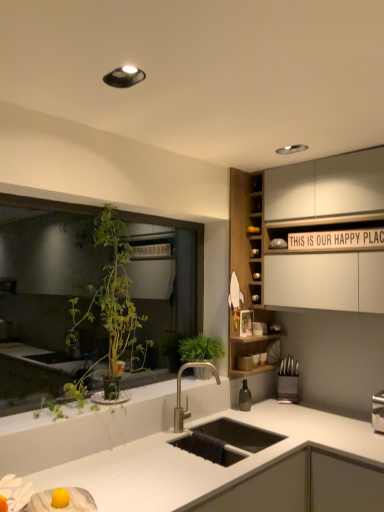
Question: From their relative heights in the image, would you say satin nickel faucet at center is taller or shorter than green leafy plant at left?

Choices:
 (A) short
 (B) tall

Answer: (A)

Question: From a real-world perspective, is satin nickel faucet at center above or below green leafy plant at left?

Choices:
 (A) above
 (B) below

Answer: (B)

Question: Estimate the real-world distances between objects in this image. Which object is closer to the white matte countertop at center?

Choices:
 (A) green woven basket at center
 (B) satin nickel faucet at center
 (C) green leafy plant at left
 (D) wooden cabinet at upper right
 (E) black plastic knife block at right

Answer: (B)

Question: Which is farther from the wooden cabinet at upper right?

Choices:
 (A) black plastic knife block at right
 (B) satin nickel faucet at center
 (C) white matte countertop at center
 (D) green woven basket at center
 (E) green leafy plant at left

Answer: (C)